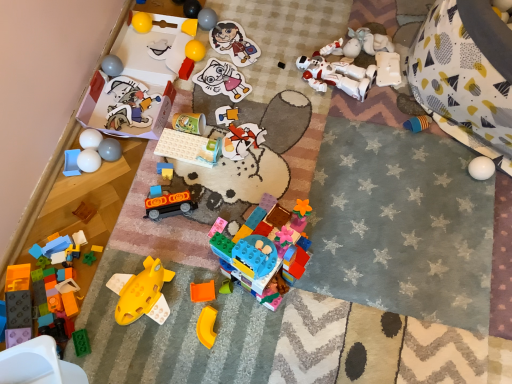
Find the location of a particular element. The height and width of the screenshot is (384, 512). vacant space that is in between translucent orange plastic at center, the fifth toy in the right-to-left sequence, and black plastic train at center, which is counted as the tenth toy, starting from the left is located at coordinates (193, 250).